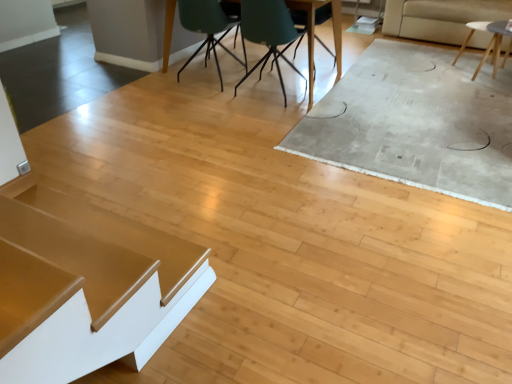
At what (x,y) coordinates should I click in order to perform the action: click on free spot in front of white matte table at upper right, which is the 3th table from left to right. Please return your answer as a coordinate pair (x, y). Looking at the image, I should click on (481, 94).